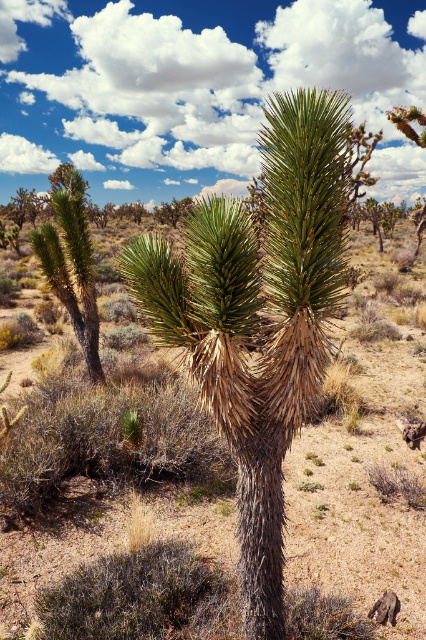
You are standing in the desert and see the white fluffy cloud at upper center and the green spiky plant at left. From your perspective, which object is located to the right?

The white fluffy cloud at upper center is located to the right of the green spiky plant at left.

You are an astronaut on Mars who wants to compare the size of the white fluffy cloud at upper center and the green spiky plant at center in the image. Which one appears larger?

The white fluffy cloud at upper center appears larger than the green spiky plant at center.

You are standing in the desert scene looking at the Joshua tree and the surrounding plants. There are two points marked in the image. One is at coordinate point (216, 401) and the other is at point (77, 257). Which of these two points is closer to your viewpoint?

Point (216, 401) is closer to the camera than point (77, 257).